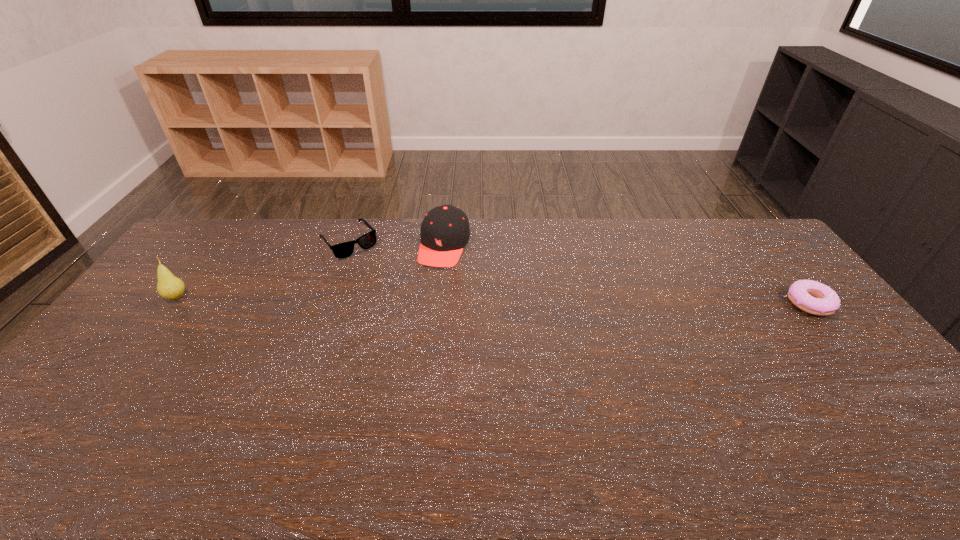
The width and height of the screenshot is (960, 540). I want to click on vacant region that satisfies the following two spatial constraints: 1. on the back side of the leftmost object; 2. on the left side of the third shortest object, so click(x=215, y=246).